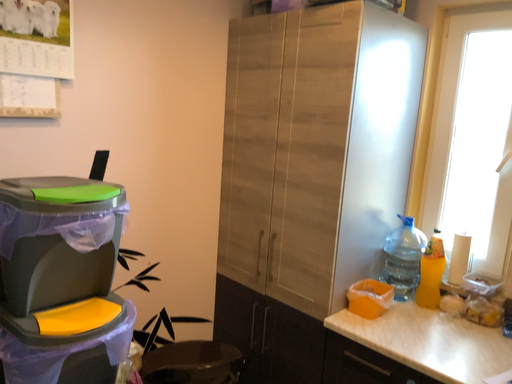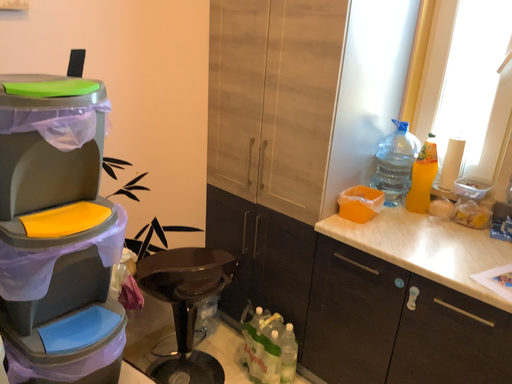
Question: Which way did the camera rotate in the video?

Choices:
 (A) rotated upward
 (B) rotated downward

Answer: (B)